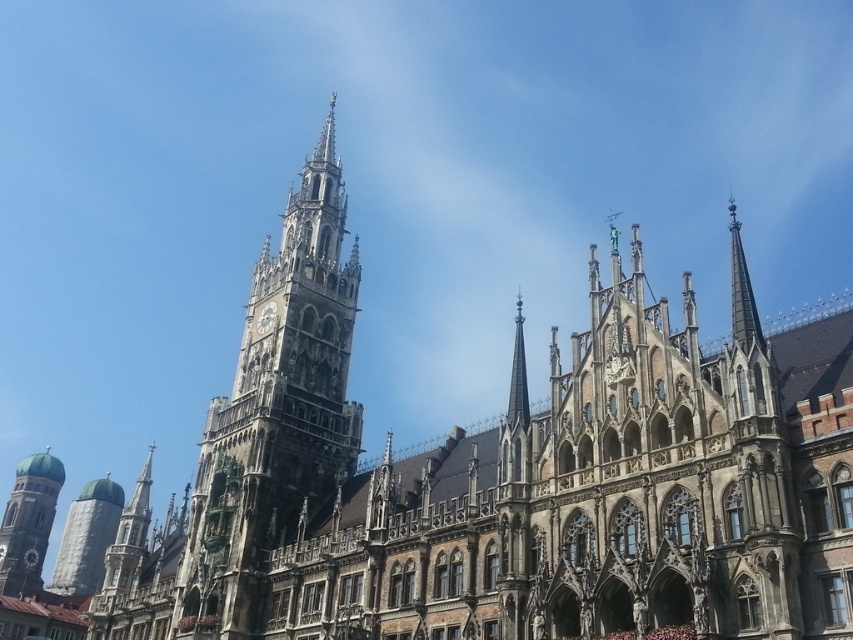
This screenshot has height=640, width=853. I want to click on stone gothic tower at center, so click(x=276, y=412).

Based on the photo, does stone gothic tower at center appear on the right side of green domed tower at lower left?

Yes, stone gothic tower at center is to the right of green domed tower at lower left.

Between point (262, 317) and point (32, 570), which one is positioned in front?

Positioned in front is point (262, 317).

Find the location of a particular element. stone gothic tower at center is located at coordinates (276, 412).

Which is more to the left, stone gothic tower at center or smooth gray spire at center?

From the viewer's perspective, stone gothic tower at center appears more on the left side.

Is point (206, 422) less distant than point (525, 381)?

No, (206, 422) is behind (525, 381).

Where is `stone gothic tower at center`? This screenshot has width=853, height=640. stone gothic tower at center is located at coordinates (276, 412).

Locate an element on the screen. This screenshot has height=640, width=853. stone gothic tower at center is located at coordinates (276, 412).

Can you confirm if stone gothic tower at center is positioned to the right of silver metallic tower at lower left?

Correct, you'll find stone gothic tower at center to the right of silver metallic tower at lower left.

Locate an element on the screen. stone gothic tower at center is located at coordinates (276, 412).